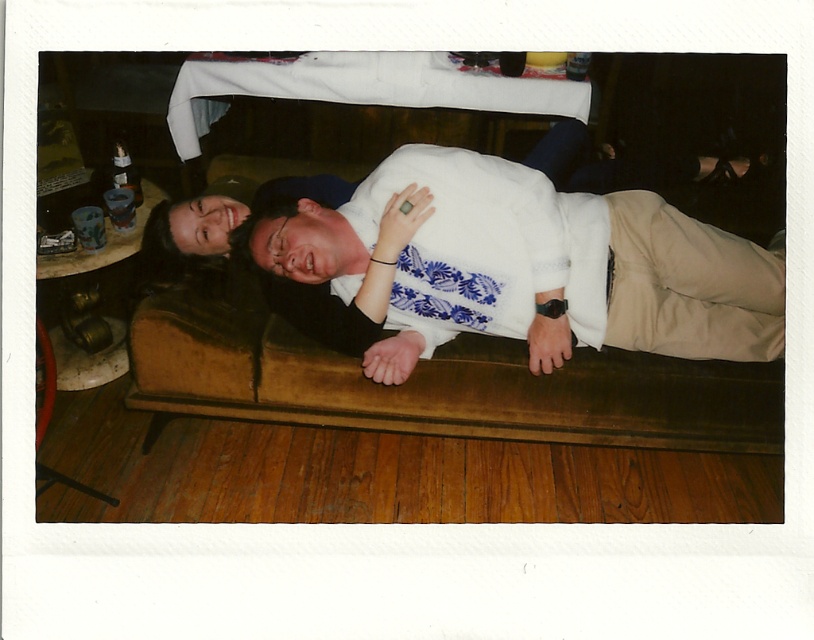
Question: Which of the following is the farthest from the observer?

Choices:
 (A) brown leather couch at center
 (B) white fabric shirt at center

Answer: (A)

Question: Which object appears closest to the camera in this image?

Choices:
 (A) white fabric shirt at center
 (B) brown leather couch at center

Answer: (A)

Question: Which of the following is the closest to the observer?

Choices:
 (A) (444, 196)
 (B) (272, 333)

Answer: (A)

Question: In this image, where is brown leather couch at center located relative to white fabric shirt at center?

Choices:
 (A) above
 (B) below

Answer: (B)

Question: From the image, what is the correct spatial relationship of brown leather couch at center in relation to white fabric shirt at center?

Choices:
 (A) below
 (B) above

Answer: (A)

Question: Is brown leather couch at center to the left of white fabric shirt at center from the viewer's perspective?

Choices:
 (A) yes
 (B) no

Answer: (A)